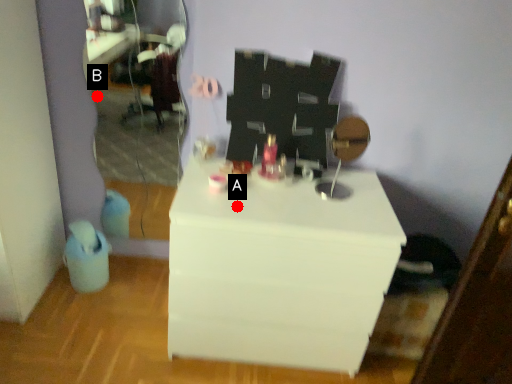
Question: Two points are circled on the image, labeled by A and B beside each circle. Which point appears closest to the camera in this image?

Choices:
 (A) A is closer
 (B) B is closer

Answer: (A)